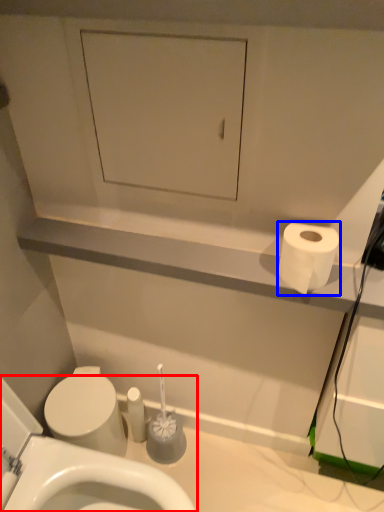
Question: Which point is further to the camera, toilet (highlighted by a red box) or toilet paper (highlighted by a blue box)?

Choices:
 (A) toilet
 (B) toilet paper

Answer: (B)